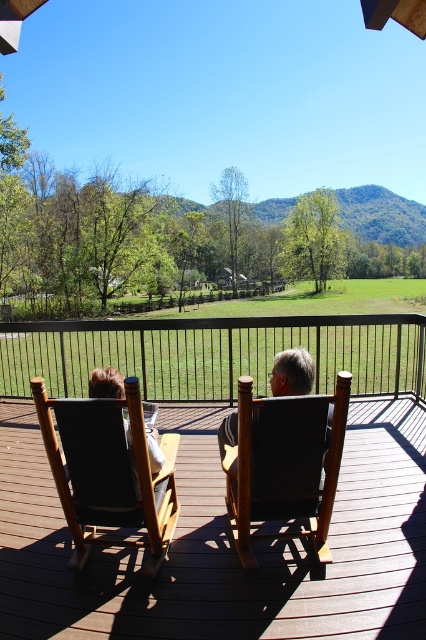
Question: Among these points, which one is nearest to the camera?

Choices:
 (A) 94,451
 (B) 108,369
 (C) 325,404

Answer: (C)

Question: Does green grassy field at center have a smaller size compared to brown leather chair at center?

Choices:
 (A) yes
 (B) no

Answer: (B)

Question: Which point is closer to the camera?

Choices:
 (A) brown wood deck at center
 (B) black fabric chair at center
 (C) dark gray fabric chair at center
 (D) brown leather chair at center

Answer: (B)

Question: In this image, where is green grassy field at center located relative to dark gray fabric chair at center?

Choices:
 (A) above
 (B) below

Answer: (A)

Question: Which point appears closest to the camera in this image?

Choices:
 (A) (80, 435)
 (B) (310, 369)
 (C) (163, 429)
 (D) (89, 348)

Answer: (A)

Question: Where is brown wood deck at center located in relation to black fabric chair at center in the image?

Choices:
 (A) right
 (B) left

Answer: (B)